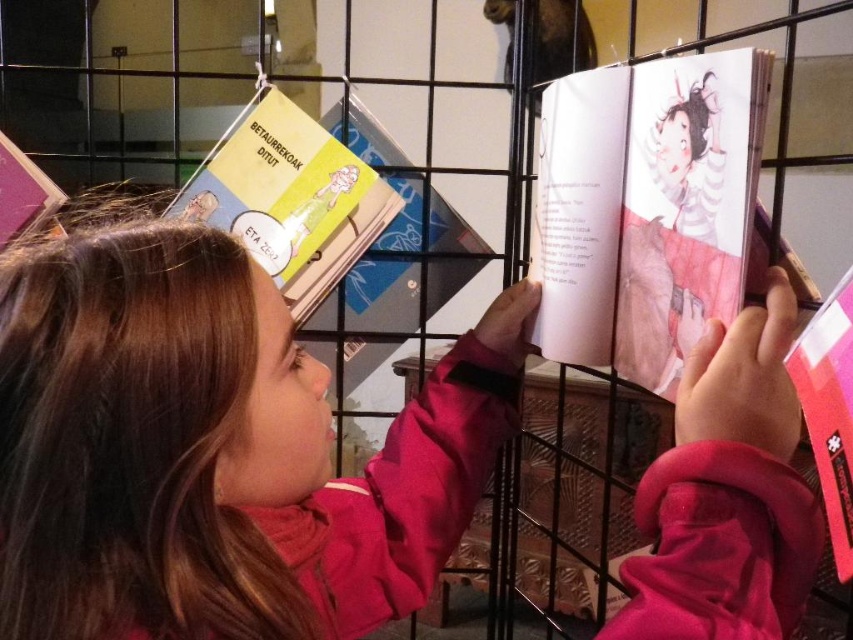
Question: Which is nearer to the yellow paper book at upper left?

Choices:
 (A) hardcover book at center
 (B) matte yellow book at upper left
 (C) pink matte book at upper right
 (D) smooth pink jacket at center

Answer: (A)

Question: Can you confirm if yellow paper book at upper left is smaller than pink matte book at upper right?

Choices:
 (A) no
 (B) yes

Answer: (A)

Question: Which is farther from the yellow paper book at upper left?

Choices:
 (A) matte yellow book at upper left
 (B) hardcover book at center
 (C) smooth pink jacket at center

Answer: (A)

Question: Does yellow paper book at upper left appear on the left side of hardcover book at center?

Choices:
 (A) yes
 (B) no

Answer: (A)

Question: Which of the following is the closest to the observer?

Choices:
 (A) (352, 205)
 (B) (113, 602)

Answer: (B)

Question: Is smooth pink jacket at center below pink matte book at upper right?

Choices:
 (A) yes
 (B) no

Answer: (A)